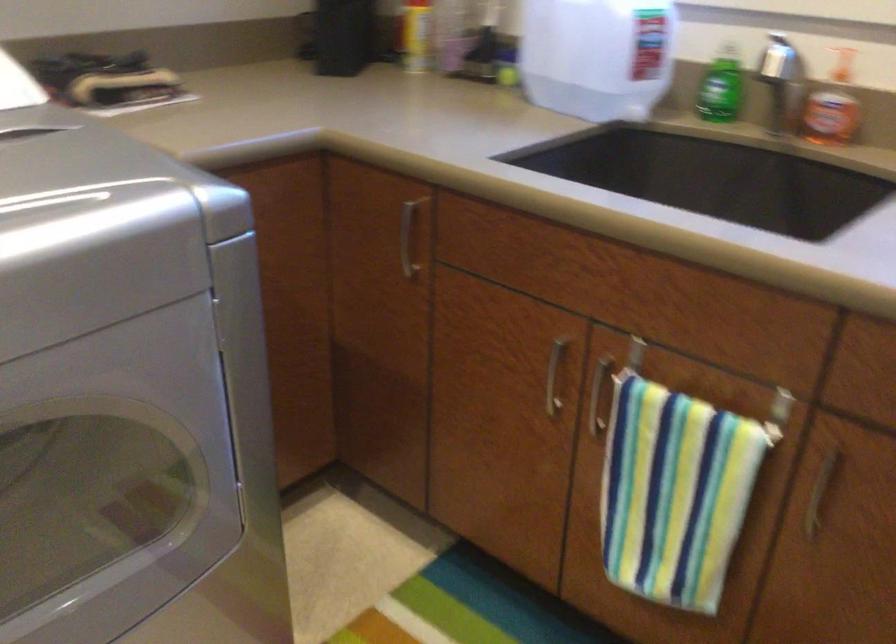
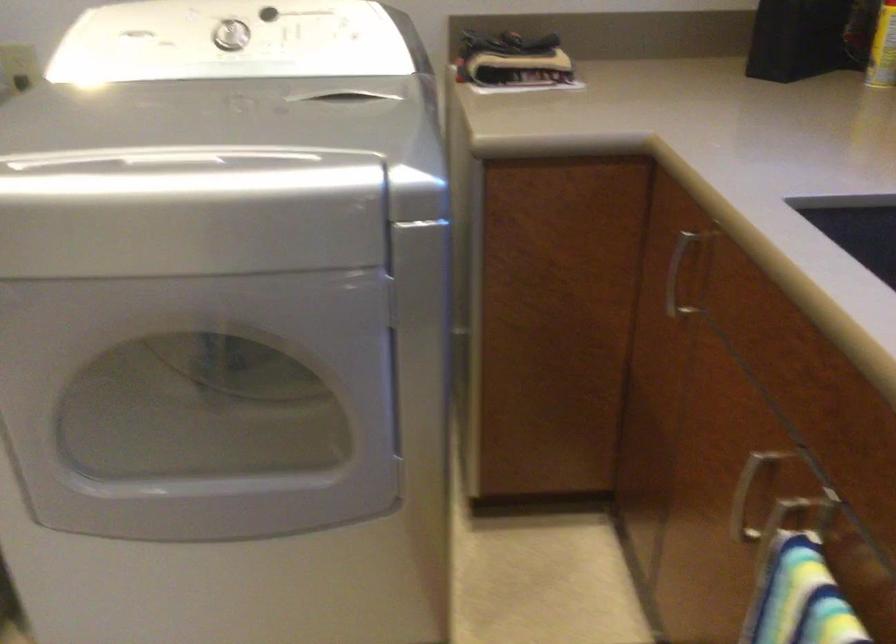
Locate, in the second image, the point that corresponds to [539,384] in the first image.

(745, 497)